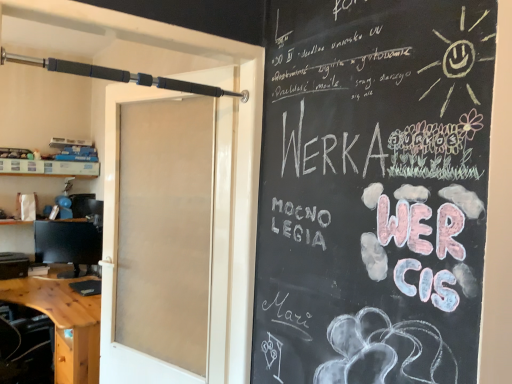
Question: Considering the relative sizes of white paper bag at left and black rubberized barbell at upper left in the image provided, is white paper bag at left shorter than black rubberized barbell at upper left?

Choices:
 (A) yes
 (B) no

Answer: (B)

Question: Is white paper bag at left taller than black rubberized barbell at upper left?

Choices:
 (A) no
 (B) yes

Answer: (B)

Question: Considering the relative sizes of white paper bag at left and black rubberized barbell at upper left in the image provided, is white paper bag at left bigger than black rubberized barbell at upper left?

Choices:
 (A) yes
 (B) no

Answer: (A)

Question: Is black rubberized barbell at upper left at the back of white paper bag at left?

Choices:
 (A) no
 (B) yes

Answer: (A)

Question: Can you confirm if white paper bag at left is positioned to the right of black rubberized barbell at upper left?

Choices:
 (A) yes
 (B) no

Answer: (B)

Question: Based on their sizes in the image, would you say wooden desk at lower left is bigger or smaller than matte black monitor at left?

Choices:
 (A) small
 (B) big

Answer: (B)

Question: Considering the positions of point (96, 299) and point (74, 258), is point (96, 299) closer or farther from the camera than point (74, 258)?

Choices:
 (A) farther
 (B) closer

Answer: (B)

Question: Would you say wooden desk at lower left is inside or outside matte black monitor at left?

Choices:
 (A) outside
 (B) inside

Answer: (A)

Question: Looking at their shapes, would you say wooden desk at lower left is wider or thinner than matte black monitor at left?

Choices:
 (A) wide
 (B) thin

Answer: (A)

Question: In the image, is white paper bag at left positioned in front of or behind black rubberized barbell at upper left?

Choices:
 (A) behind
 (B) front

Answer: (A)

Question: Is point (48, 196) closer or farther from the camera than point (7, 54)?

Choices:
 (A) farther
 (B) closer

Answer: (A)

Question: Would you say white paper bag at left is inside or outside black rubberized barbell at upper left?

Choices:
 (A) inside
 (B) outside

Answer: (B)

Question: Considering the positions of white paper bag at left and black rubberized barbell at upper left in the image, is white paper bag at left taller or shorter than black rubberized barbell at upper left?

Choices:
 (A) short
 (B) tall

Answer: (B)

Question: Is wooden desk at lower left in front of or behind white paper bag at left in the image?

Choices:
 (A) front
 (B) behind

Answer: (A)

Question: From the image's perspective, is wooden desk at lower left above or below white paper bag at left?

Choices:
 (A) below
 (B) above

Answer: (A)